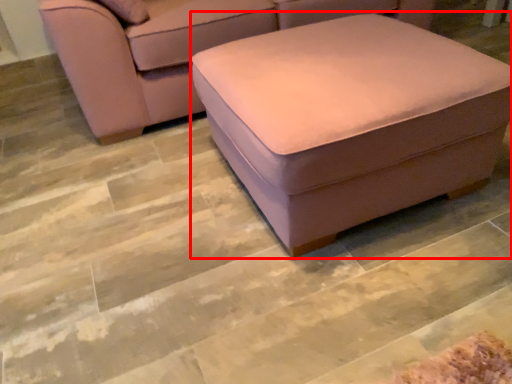
Question: From the image's perspective, what is the correct spatial relationship of stool (annotated by the red box) in relation to studio couch?

Choices:
 (A) below
 (B) above

Answer: (A)